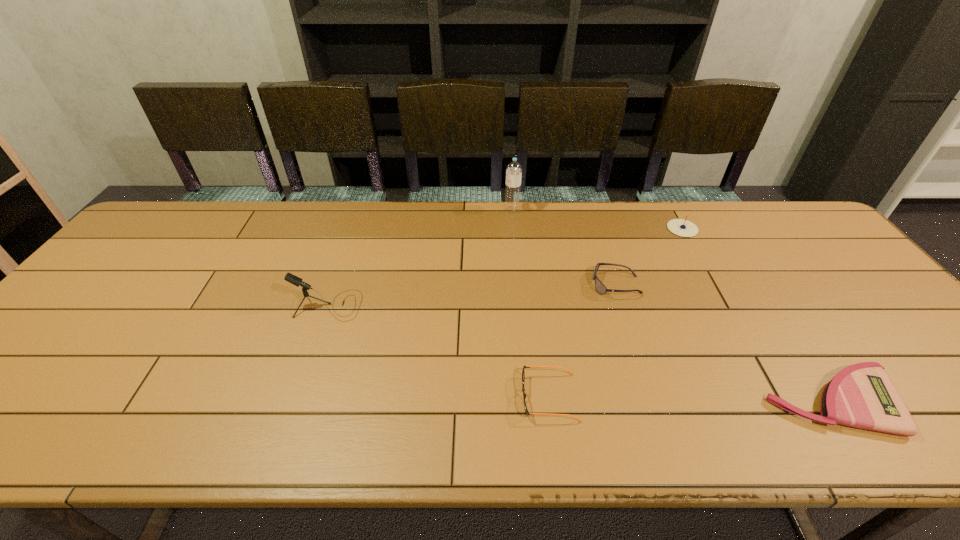
I want to click on vacant area that lies between the farthest object and the wristlet, so click(672, 306).

The height and width of the screenshot is (540, 960). In order to click on vacant space in between the leftmost object and the sunglasses in this screenshot , I will do `click(472, 295)`.

Locate an element on the screen. The image size is (960, 540). the fifth closest object to the compass is located at coordinates (289, 277).

Select which object appears as the third closest to the wristlet. Please provide its 2D coordinates. Your answer should be formatted as a tuple, i.e. [(x, y)], where the tuple contains the x and y coordinates of a point satisfying the conditions above.

[(680, 227)]

Identify the location of vacant area in the image that satisfies the following two spatial constraints: 1. on the stand of the microphone; 2. on the back side of the wristlet. The height and width of the screenshot is (540, 960). (295, 402).

This screenshot has width=960, height=540. Find the location of `free space in the image that satisfies the following two spatial constraints: 1. on the back side of the wristlet; 2. on the lenses of the third shortest object`. free space in the image that satisfies the following two spatial constraints: 1. on the back side of the wristlet; 2. on the lenses of the third shortest object is located at coordinates (756, 285).

I want to click on free location that satisfies the following two spatial constraints: 1. on the front-facing side of the wristlet; 2. on the left side of the spectacles, so click(550, 402).

The image size is (960, 540). I want to click on free point that satisfies the following two spatial constraints: 1. on the stand of the second tallest object; 2. on the left side of the wristlet, so click(295, 402).